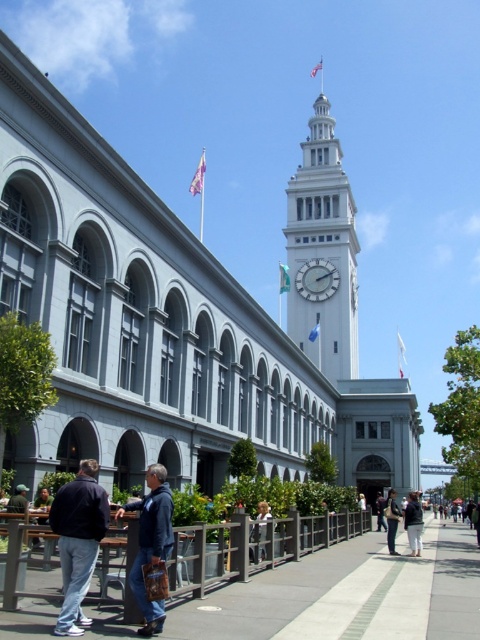
Question: Among these points, which one is farthest from the camera?

Choices:
 (A) [320, 280]
 (B) [408, 492]
 (C) [323, 124]
 (D) [380, 508]

Answer: (C)

Question: Which point is closer to the camera?

Choices:
 (A) light brown leather jacket at center
 (B) dark blue jeans at center
 (C) white cotton shirt at center
 (D) white glossy clock at upper center

Answer: (A)

Question: Does white stone clock tower at upper center appear on the right side of black leather jacket at center?

Choices:
 (A) yes
 (B) no

Answer: (A)

Question: From the image, what is the correct spatial relationship of white stone clock tower at upper center in relation to denim jacket at lower center?

Choices:
 (A) above
 (B) below

Answer: (A)

Question: Can you confirm if white stone clock tower at upper center is smaller than dark blue jacket at center?

Choices:
 (A) yes
 (B) no

Answer: (B)

Question: Considering the real-world distances, which object is closest to the dark blue jacket at lower left?

Choices:
 (A) dark blue jacket at center
 (B) concrete sidewalk at center
 (C) white glossy clock at upper center

Answer: (B)